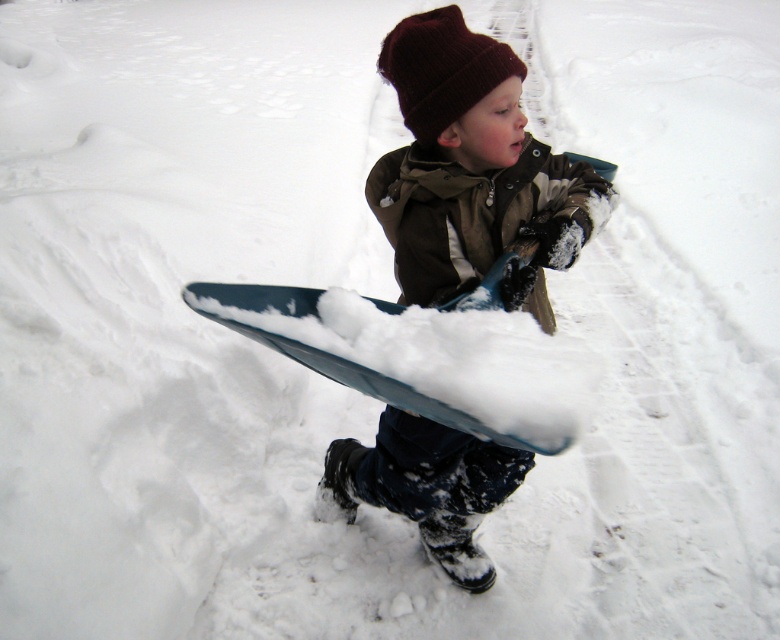
Question: Is matte blue sled at center behind burgundy knit beanie at upper center?

Choices:
 (A) yes
 (B) no

Answer: (B)

Question: Among these objects, which one is nearest to the camera?

Choices:
 (A) blue plastic snowboard at center
 (B) matte blue sled at center

Answer: (A)

Question: Can you confirm if burgundy knit beanie at upper center is bigger than blue plastic snowboard at center?

Choices:
 (A) no
 (B) yes

Answer: (A)

Question: Does burgundy knit beanie at upper center appear under blue plastic snowboard at center?

Choices:
 (A) yes
 (B) no

Answer: (B)

Question: Which object appears closest to the camera in this image?

Choices:
 (A) matte blue sled at center
 (B) blue plastic snowboard at center

Answer: (B)

Question: Which object is closer to the camera taking this photo?

Choices:
 (A) burgundy knit beanie at upper center
 (B) blue plastic snowboard at center
 (C) matte blue sled at center

Answer: (B)